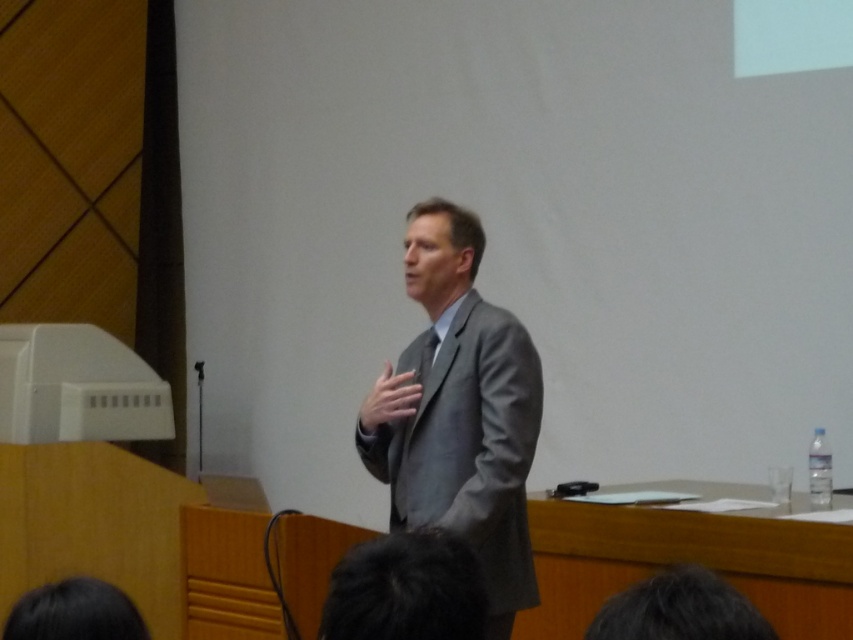
You are an attendee at this event and want to take a photo of the speaker. The camera you have can only focus on objects within a 0.1 unit radius around the point where you aim it. If you aim your camera at the point where the dark hair at lower center is located, will the camera focus on the speaker?

The dark hair at lower center is located at point (x=405, y=589). Since the speaker is the person with dark hair at lower center, aiming the camera at that point will focus on the speaker.

You are a stagehand setting up for an event. You need to place a microphone stand exactly 0.5 meters to the right of the gray matte suit at center. Where should you place the microphone stand in terms of coordinates?

Since the gray matte suit at center is located at coordinates point (x=459, y=412), placing the microphone stand 0.5 meters to the right would mean adjusting the x coordinate. The new coordinates would be approximately 0.644 plus 0.5 meters in the x direction. However, without knowing the scale of the coordinate system, we cannot provide exact numerical coordinates. Please ensure the microphone stand is positioned 0.5 meters to the right of the gray matte suit at center.